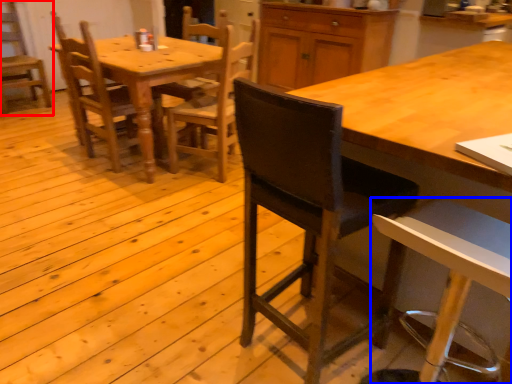
Question: Which object appears closest to the camera in this image, chair (highlighted by a red box) or chair (highlighted by a blue box)?

Choices:
 (A) chair
 (B) chair

Answer: (B)